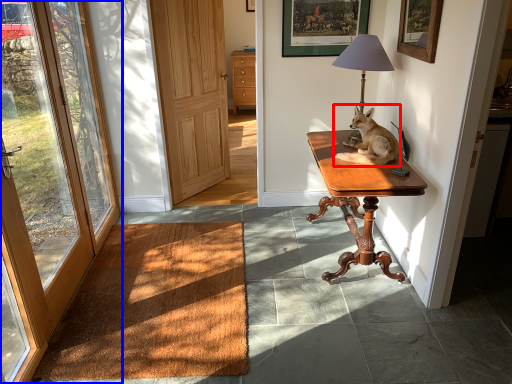
Question: Which of the following is the farthest to the observer, dog (highlighted by a red box) or door (highlighted by a blue box)?

Choices:
 (A) dog
 (B) door

Answer: (A)